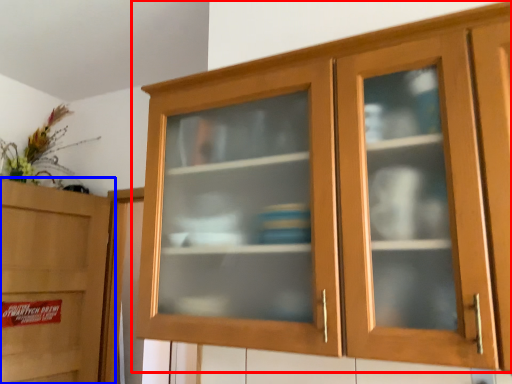
Question: Among these objects, which one is farthest to the camera, cupboard (highlighted by a red box) or cabinetry (highlighted by a blue box)?

Choices:
 (A) cupboard
 (B) cabinetry

Answer: (B)